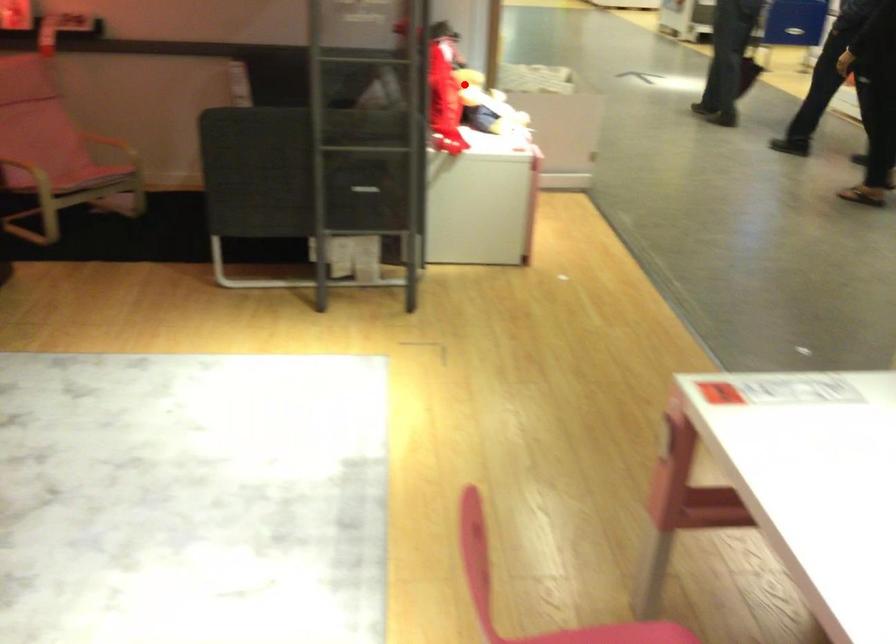
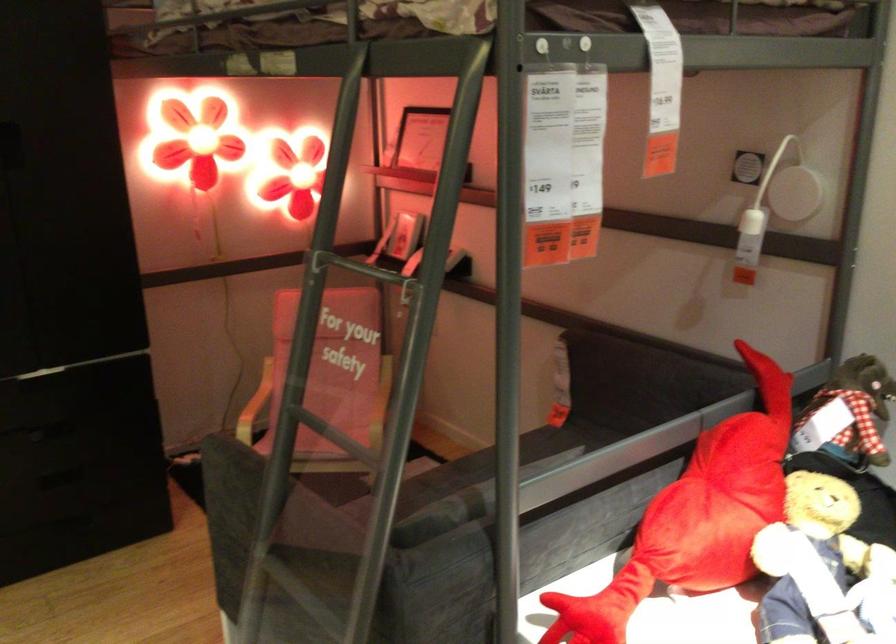
Find the pixel in the second image that matches the highlighted location in the first image.

(719, 502)